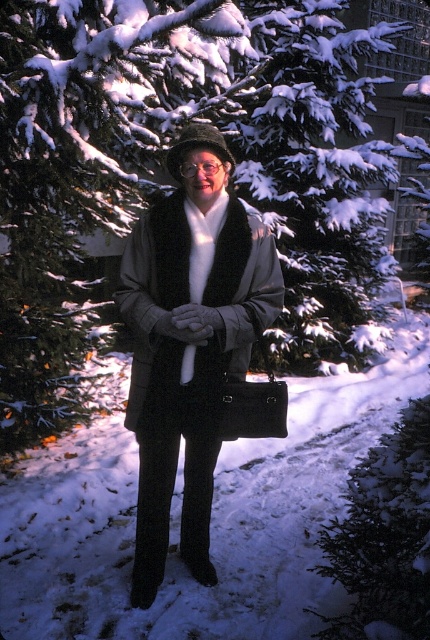
Question: Which point is farther from the camera taking this photo?

Choices:
 (A) (42, 236)
 (B) (224, 284)
 (C) (187, 177)

Answer: (A)

Question: Can you confirm if matte black coat at center is positioned below transparent plastic goggles at center?

Choices:
 (A) no
 (B) yes

Answer: (B)

Question: Which is nearer to the transparent plastic goggles at center?

Choices:
 (A) matte black coat at center
 (B) snow-covered evergreen tree at center

Answer: (A)

Question: Which point is farther from the camera taking this photo?

Choices:
 (A) (187, 161)
 (B) (153, 323)
 (C) (347, 93)

Answer: (C)

Question: Does matte black coat at center have a greater width compared to transparent plastic goggles at center?

Choices:
 (A) yes
 (B) no

Answer: (A)

Question: Can you confirm if snow-covered evergreen tree at center is smaller than transparent plastic goggles at center?

Choices:
 (A) yes
 (B) no

Answer: (B)